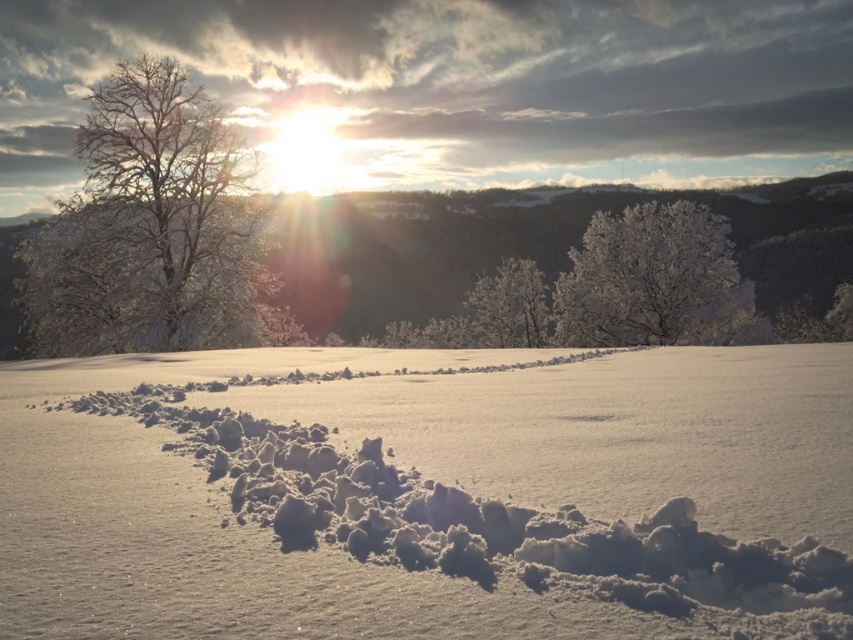
Is point (692, 596) closer to camera compared to point (99, 272)?

Yes, it is in front of point (99, 272).

Is white fluffy snow at center smaller than snow-covered tree at left?

Yes, white fluffy snow at center is smaller than snow-covered tree at left.

Between point (103, 609) and point (146, 332), which one is positioned in front?

Point (103, 609) is in front.

The width and height of the screenshot is (853, 640). I want to click on white fluffy snow at center, so click(x=431, y=496).

Can you confirm if white fluffy snow at center is positioned to the left of frosted white tree at upper center?

Correct, you'll find white fluffy snow at center to the left of frosted white tree at upper center.

How much distance is there between white fluffy snow at center and frosted white tree at upper center?

44.42 meters

At what (x,y) coordinates should I click in order to perform the action: click on white fluffy snow at center. Please return your answer as a coordinate pair (x, y). Looking at the image, I should click on (431, 496).

Where is `white fluffy snow at center`? white fluffy snow at center is located at coordinates (431, 496).

Between point (665, 237) and point (506, 312), which one is positioned in front?

Point (665, 237)

Locate an element on the screen. frosted white tree at upper center is located at coordinates tap(648, 276).

Which is in front, point (657, 314) or point (502, 289)?

Point (657, 314)

At what (x,y) coordinates should I click in order to perform the action: click on frosted white tree at upper center. Please return your answer as a coordinate pair (x, y). The image size is (853, 640). Looking at the image, I should click on (648, 276).